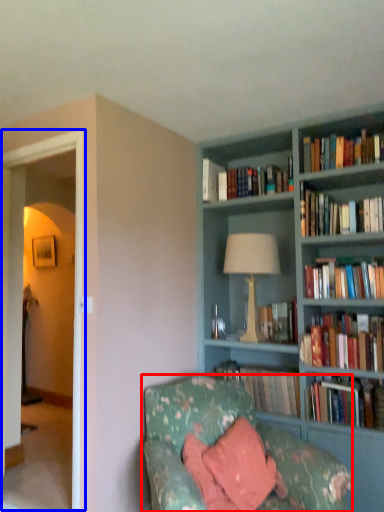
Question: Which point is further to the camera, studio couch (highlighted by a red box) or glass door (highlighted by a blue box)?

Choices:
 (A) studio couch
 (B) glass door

Answer: (B)